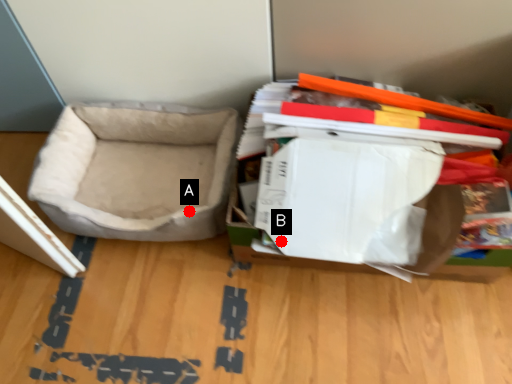
Question: Two points are circled on the image, labeled by A and B beside each circle. Which point appears closest to the camera in this image?

Choices:
 (A) A is closer
 (B) B is closer

Answer: (B)